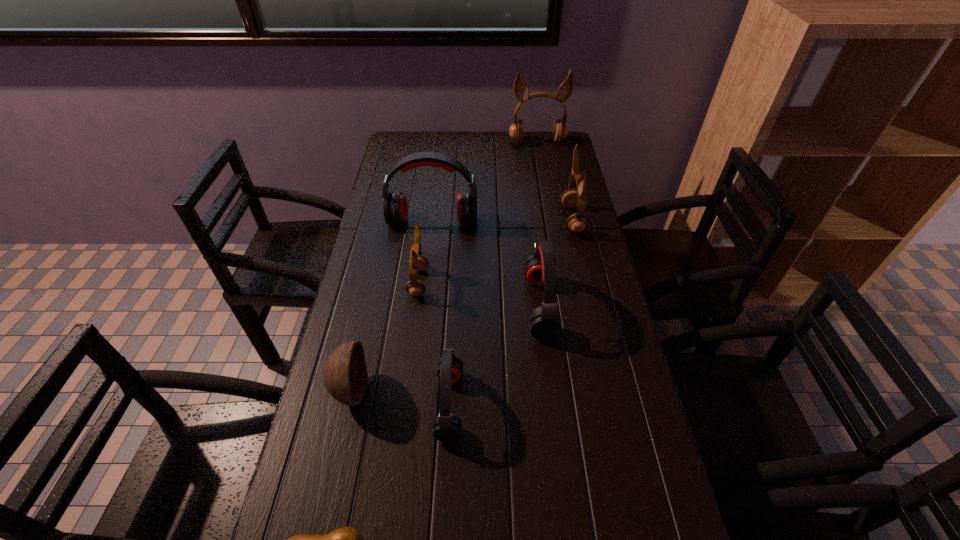
Find the location of a particular element. The image size is (960, 540). blank space located on the ear cups of the shortest earphone is located at coordinates (485, 404).

The width and height of the screenshot is (960, 540). I want to click on vacant space located 0.270m on the back of the bowl, so click(374, 284).

Identify the location of object at the far edge. (521, 90).

I want to click on bowl present at the left edge, so click(345, 375).

Image resolution: width=960 pixels, height=540 pixels. Find the location of `object that is at the far right corner`. object that is at the far right corner is located at coordinates (521, 90).

The width and height of the screenshot is (960, 540). Identify the location of vacant region at the far edge. (474, 159).

Where is `free location at the left edge of the desktop`? The image size is (960, 540). free location at the left edge of the desktop is located at coordinates (407, 187).

The image size is (960, 540). In the image, there is a desktop. Find the location of `vacant space at the right edge`. vacant space at the right edge is located at coordinates (566, 256).

In the image, there is a desktop. Identify the location of vacant space at the far left corner. Image resolution: width=960 pixels, height=540 pixels. (407, 133).

Identify the location of free space at the far right corner of the desktop. The width and height of the screenshot is (960, 540). (564, 162).